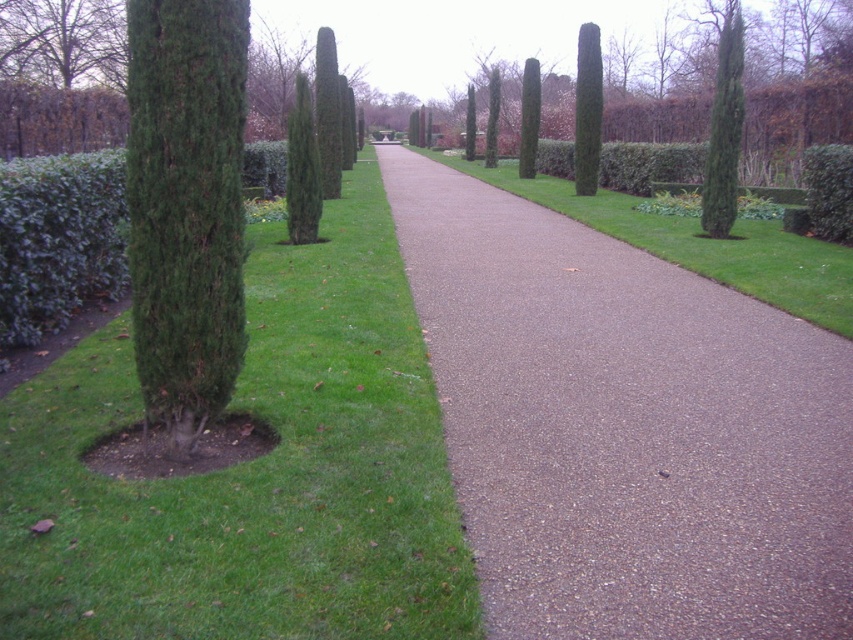
What do you see at coordinates (186, 205) in the screenshot? Image resolution: width=853 pixels, height=640 pixels. I see `green textured cypress at left` at bounding box center [186, 205].

Is the position of green textured cypress at left more distant than that of green leafy hedge at left?

No, it is in front of green leafy hedge at left.

Does point (196, 417) come behind point (59, 307)?

No, (196, 417) is in front of (59, 307).

Locate an element on the screen. green textured cypress at left is located at coordinates (186, 205).

Can you confirm if green leafy hedge at left is positioned to the left of green textured tree at upper left?

Incorrect, green leafy hedge at left is not on the left side of green textured tree at upper left.

Where is `green leafy hedge at left`? green leafy hedge at left is located at coordinates 57,240.

Is point (849, 570) behind point (28, 307)?

No, (849, 570) is closer to viewer.

What do you see at coordinates (624, 426) in the screenshot? I see `gray gravel path at center` at bounding box center [624, 426].

Does point (756, 552) come in front of point (3, 273)?

That is True.

Identify the location of gray gravel path at center. (624, 426).